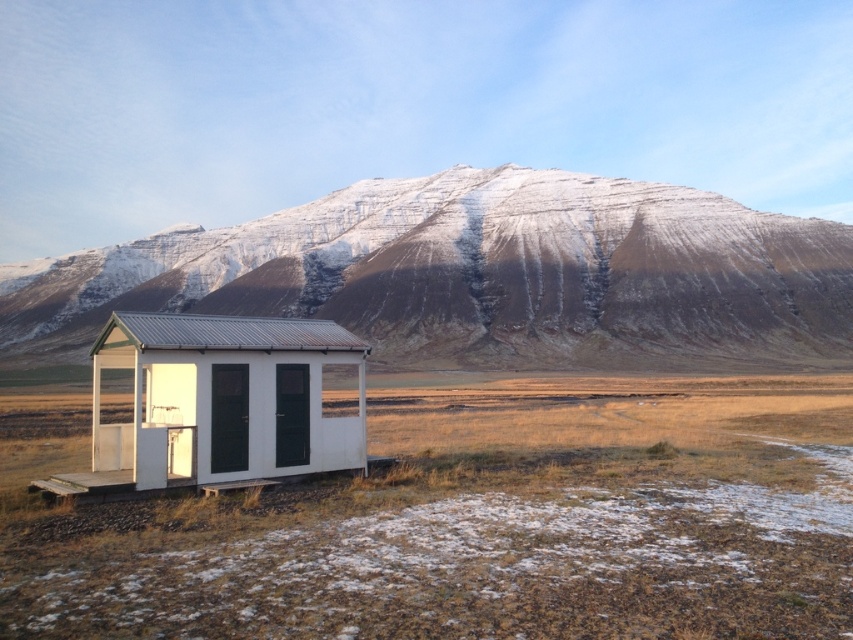
Which is in front, point (41, 596) or point (265, 340)?

Point (41, 596)

Is dry grass at lower left further to camera compared to white matte cabin at center?

No, dry grass at lower left is closer to the viewer.

At what (x,y) coordinates should I click in order to perform the action: click on dry grass at lower left. Please return your answer as a coordinate pair (x, y). Image resolution: width=853 pixels, height=640 pixels. Looking at the image, I should click on (479, 524).

Who is positioned more to the right, snowy rock mountain at center or white matte cabin at center?

From the viewer's perspective, white matte cabin at center appears more on the right side.

Is snowy rock mountain at center closer to camera compared to white matte cabin at center?

No.

Which is in front, point (200, 285) or point (161, 481)?

Point (161, 481) is in front.

Where is `snowy rock mountain at center`? This screenshot has height=640, width=853. snowy rock mountain at center is located at coordinates (480, 275).

Does dry grass at lower left appear over snowy rock mountain at center?

No.

Based on the photo, can you confirm if dry grass at lower left is bigger than snowy rock mountain at center?

Incorrect, dry grass at lower left is not larger than snowy rock mountain at center.

Is point (848, 541) closer to camera compared to point (328, 237)?

Yes, point (848, 541) is closer to viewer.

Find the location of `dry grass at lower left`. dry grass at lower left is located at coordinates (479, 524).